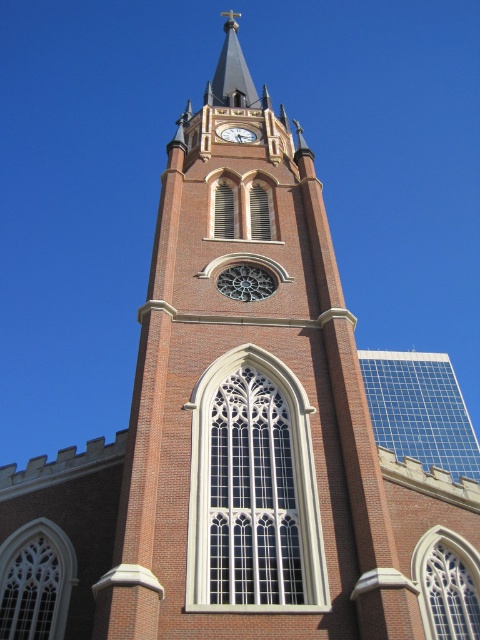
Looking at the church tower, where is the smooth gray steeple at upper center in relation to the white glossy clock at upper center?

The smooth gray steeple at upper center is to the left of the white glossy clock at upper center.

You are an architect analyzing the church tower. You notice the smooth gray steeple at upper center and the white glossy clock at upper center. Which of these two elements has a greater width?

The smooth gray steeple at upper center has a greater width than the white glossy clock at upper center.